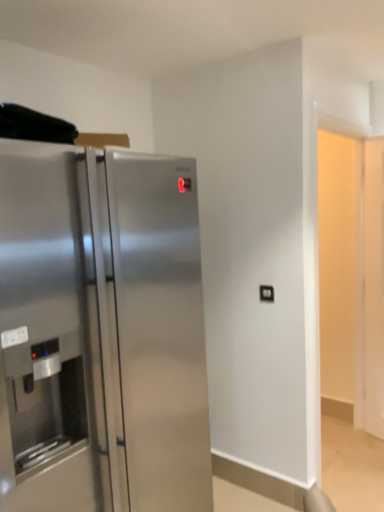
This screenshot has width=384, height=512. What do you see at coordinates (101, 332) in the screenshot?
I see `stainless steel refrigerator at left` at bounding box center [101, 332].

You are a GUI agent. You are given a task and a screenshot of the screen. Output one action in this format:
    pyautogui.click(x=<x>, y=<y>)
    Task: Click on the stainless steel refrigerator at left
    This screenshot has height=512, width=384.
    Given the screenshot: What is the action you would take?
    pyautogui.click(x=101, y=332)

The height and width of the screenshot is (512, 384). What are the coordinates of `black plastic outlet at center` in the screenshot? It's located at (266, 293).

What do you see at coordinates (266, 293) in the screenshot?
I see `black plastic outlet at center` at bounding box center [266, 293].

At what (x,y) coordinates should I click in order to perform the action: click on stainless steel refrigerator at left. Please return your answer as a coordinate pair (x, y). Looking at the image, I should click on (101, 332).

Is stainless steel refrigerator at left at the left side of black plastic outlet at center?

Yes.

Considering the relative positions of stainless steel refrigerator at left and black plastic outlet at center in the image provided, is stainless steel refrigerator at left behind black plastic outlet at center?

No, it is in front of black plastic outlet at center.

Which is nearer, (169, 373) or (267, 295)?

The point (169, 373) is closer.

From the image's perspective, relative to black plastic outlet at center, is stainless steel refrigerator at left above or below?

From the image's perspective, stainless steel refrigerator at left appears below black plastic outlet at center.

From a real-world perspective, who is located lower, stainless steel refrigerator at left or black plastic outlet at center?

stainless steel refrigerator at left.

Is stainless steel refrigerator at left wider or thinner than black plastic outlet at center?

stainless steel refrigerator at left is wider than black plastic outlet at center.

Is stainless steel refrigerator at left shorter than black plastic outlet at center?

No.

Considering the sizes of objects stainless steel refrigerator at left and black plastic outlet at center in the image provided, who is bigger, stainless steel refrigerator at left or black plastic outlet at center?

Bigger between the two is stainless steel refrigerator at left.

Would you say stainless steel refrigerator at left contains black plastic outlet at center?

No, black plastic outlet at center is not a part of stainless steel refrigerator at left.

Is stainless steel refrigerator at left in contact with black plastic outlet at center?

No, stainless steel refrigerator at left is not next to black plastic outlet at center.

Is stainless steel refrigerator at left facing away from black plastic outlet at center?

No.

How many degrees apart are the facing directions of stainless steel refrigerator at left and black plastic outlet at center?

They differ by 90 degrees in their facing directions.

Measure the distance from stainless steel refrigerator at left to black plastic outlet at center.

1.04 meters.

Find the location of a particular element. refrigerator located below the black plastic outlet at center (from the image's perspective) is located at coordinates (101, 332).

In the scene shown: Is black plastic outlet at center to the left or to the right of stainless steel refrigerator at left in the image?

In the image, black plastic outlet at center appears on the right side of stainless steel refrigerator at left.

Which object is further away from the camera taking this photo, black plastic outlet at center or stainless steel refrigerator at left?

black plastic outlet at center is further away from the camera.

Does point (265, 289) lie in front of point (154, 387)?

No.

From the image's perspective, is black plastic outlet at center located above stainless steel refrigerator at left?

Indeed, from the image's perspective, black plastic outlet at center is shown above stainless steel refrigerator at left.

From a real-world perspective, who is located higher, black plastic outlet at center or stainless steel refrigerator at left?

black plastic outlet at center is physically above.

In terms of width, does black plastic outlet at center look wider or thinner when compared to stainless steel refrigerator at left?

black plastic outlet at center is thinner than stainless steel refrigerator at left.

Consider the image. Can you confirm if black plastic outlet at center is shorter than stainless steel refrigerator at left?

Correct, black plastic outlet at center is not as tall as stainless steel refrigerator at left.

Is black plastic outlet at center bigger than stainless steel refrigerator at left?

No.

Is black plastic outlet at center not inside stainless steel refrigerator at left?

Yes.

Are black plastic outlet at center and stainless steel refrigerator at left beside each other?

No, black plastic outlet at center is not making contact with stainless steel refrigerator at left.

Is black plastic outlet at center turned away from stainless steel refrigerator at left?

No, black plastic outlet at center is not facing away from stainless steel refrigerator at left.

Identify the location of refrigerator on the left of black plastic outlet at center. Image resolution: width=384 pixels, height=512 pixels. (101, 332).

Where is `electric outlet behind the stainless steel refrigerator at left`? electric outlet behind the stainless steel refrigerator at left is located at coordinates (266, 293).

Find the location of a particular element. The height and width of the screenshot is (512, 384). refrigerator below the black plastic outlet at center (from a real-world perspective) is located at coordinates (101, 332).